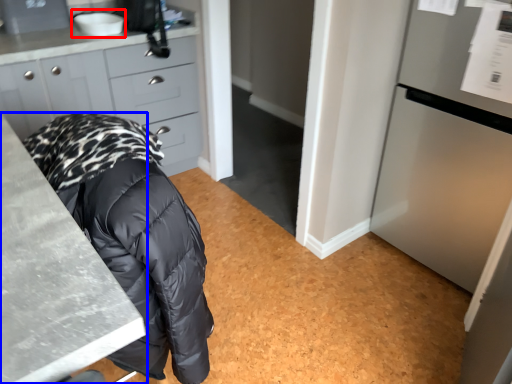
Question: Among these objects, which one is nearest to the camera, sink (highlighted by a red box) or countertop (highlighted by a blue box)?

Choices:
 (A) sink
 (B) countertop

Answer: (B)